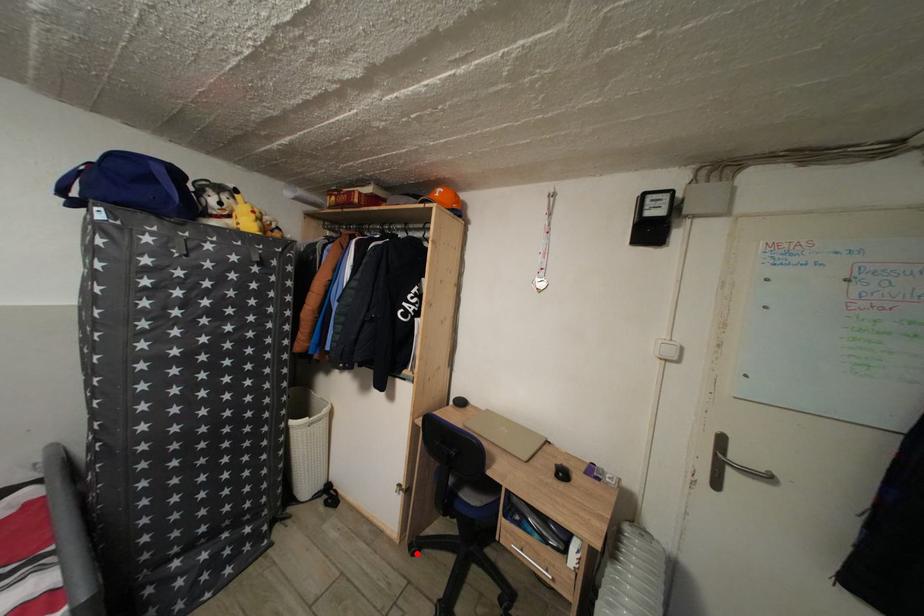
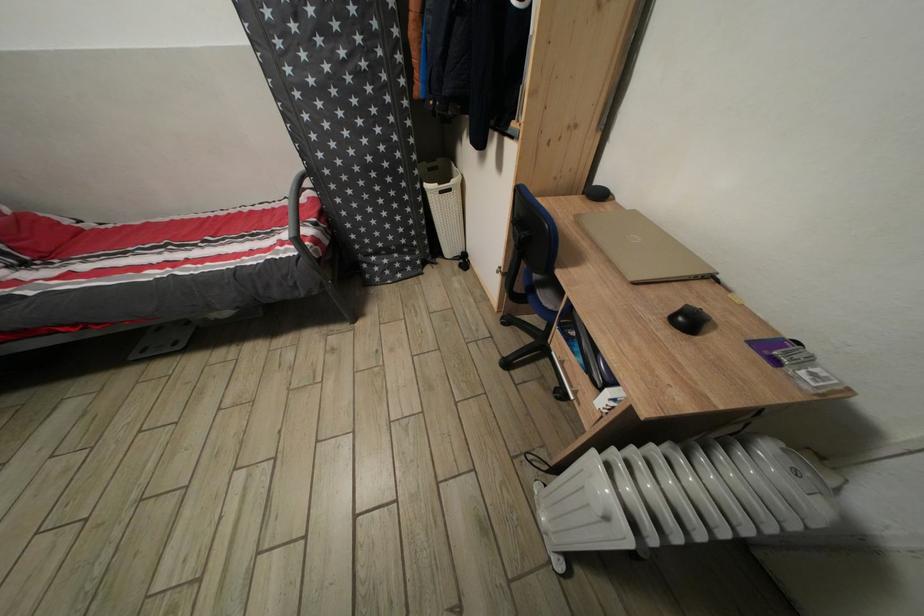
In the second image, find the point that corresponds to the highlighted location in the first image.

(509, 325)